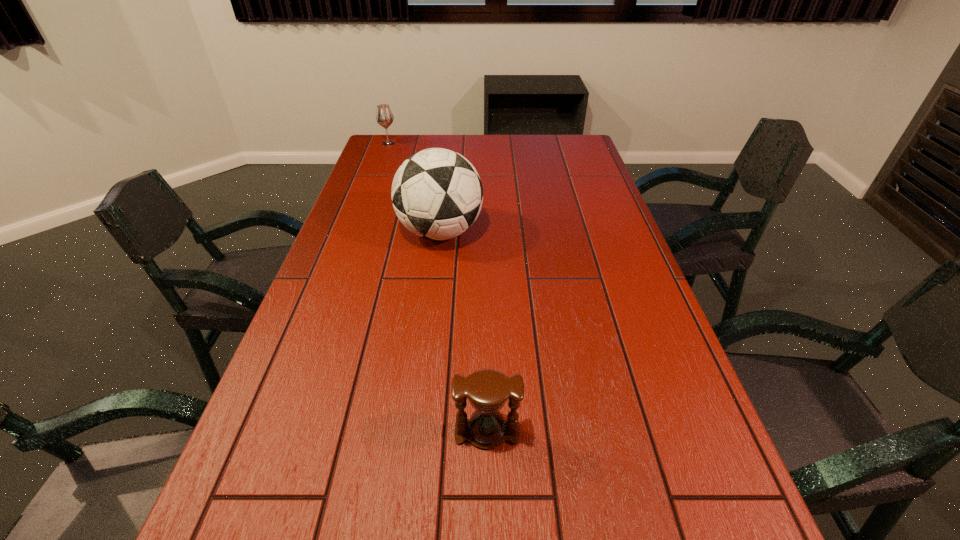
You are a GUI agent. You are given a task and a screenshot of the screen. Output one action in this format:
    pyautogui.click(x=<x>, y=<y>)
    Task: Click on the tallest object
    This screenshot has width=960, height=540.
    Given the screenshot: What is the action you would take?
    pyautogui.click(x=437, y=194)

Image resolution: width=960 pixels, height=540 pixels. I want to click on soccer ball, so click(437, 194).

Image resolution: width=960 pixels, height=540 pixels. Find the location of `the farthest object`. the farthest object is located at coordinates (384, 116).

Where is `the leftmost object`? the leftmost object is located at coordinates (384, 116).

This screenshot has width=960, height=540. Identify the location of the nearest object. (487, 390).

The height and width of the screenshot is (540, 960). Find the location of `vacant space located 0.370m on the surface of the second farthest object where the brand logo is visible`. vacant space located 0.370m on the surface of the second farthest object where the brand logo is visible is located at coordinates (605, 232).

Find the location of a particular element. free space located 0.280m on the front of the leftmost object is located at coordinates [374, 181].

Where is `free space located on the right of the hourglass`? Image resolution: width=960 pixels, height=540 pixels. free space located on the right of the hourglass is located at coordinates (697, 432).

At what (x,y) coordinates should I click in order to perform the action: click on object that is at the far edge. Please return your answer as a coordinate pair (x, y). Looking at the image, I should click on (384, 116).

I want to click on object that is positioned at the left edge, so click(x=384, y=116).